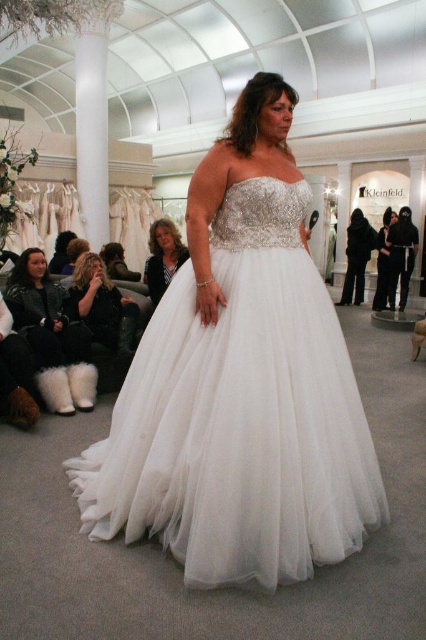
Question: Is white tulle dress at center to the right of black satin dress at center from the viewer's perspective?

Choices:
 (A) yes
 (B) no

Answer: (B)

Question: Which of these objects is positioned farthest from the white tulle dress at center?

Choices:
 (A) white faux fur boots at lower left
 (B) matte black jacket at center
 (C) black satin dress at center

Answer: (C)

Question: Does white tulle dress at center appear under matte black jacket at center?

Choices:
 (A) yes
 (B) no

Answer: (A)

Question: Which of the following is the farthest from the observer?

Choices:
 (A) white faux fur boots at lower left
 (B) white tulle dress at center
 (C) matte black jacket at center

Answer: (C)

Question: Which of these objects is positioned farthest from the matte black jacket at center?

Choices:
 (A) white faux fur boots at lower left
 (B) white tulle dress at center
 (C) fuzzy black boots at lower left

Answer: (B)

Question: Is white faux fur boots at lower left to the right of black satin dress at center from the viewer's perspective?

Choices:
 (A) yes
 (B) no

Answer: (B)